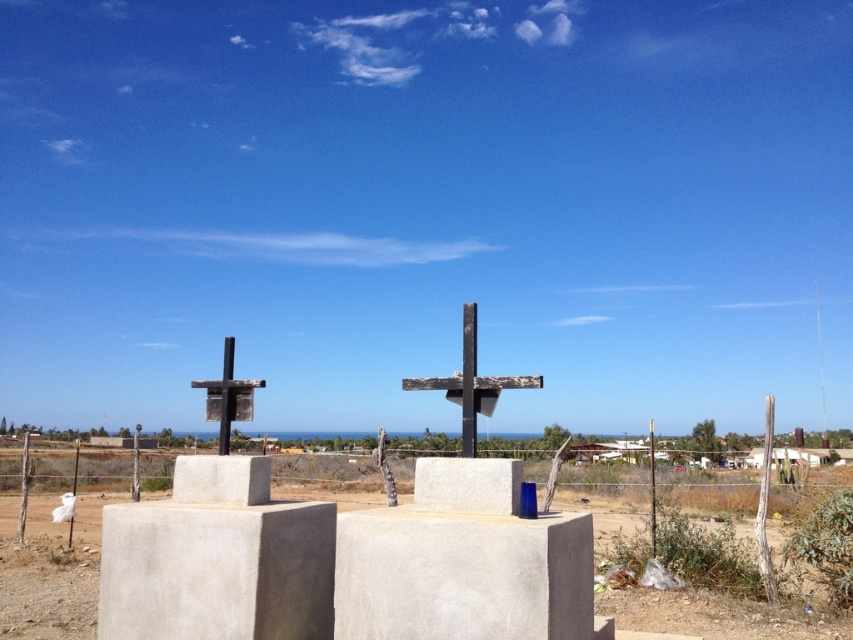
Between point (412, 621) and point (51, 637), which one is positioned in front?

Point (412, 621) is in front.

The image size is (853, 640). I want to click on smooth concrete block at center, so click(x=462, y=576).

Is point (508, 548) more distant than point (49, 588)?

No, it is not.

Image resolution: width=853 pixels, height=640 pixels. In order to click on smooth concrete block at center in this screenshot , I will do `click(462, 576)`.

From the picture: Measure the distance between smooth concrete block at center and camera.

A distance of 4.22 meters exists between smooth concrete block at center and camera.

You are a GUI agent. You are given a task and a screenshot of the screen. Output one action in this format:
    pyautogui.click(x=<x>, y=<y>)
    Task: Click on the smooth concrete block at center
    
    Given the screenshot: What is the action you would take?
    pyautogui.click(x=462, y=576)

Where is `smooth concrete block at center`? smooth concrete block at center is located at coordinates (462, 576).

Who is more distant from viewer, (115, 554) or (224, 401)?

Point (224, 401)

Can you confirm if gray concrete block at center is shorter than smooth wooden cross at center?

No.

Is point (215, 522) positioned in front of point (248, 380)?

That is True.

Locate an element on the screen. The width and height of the screenshot is (853, 640). gray concrete block at center is located at coordinates (216, 570).